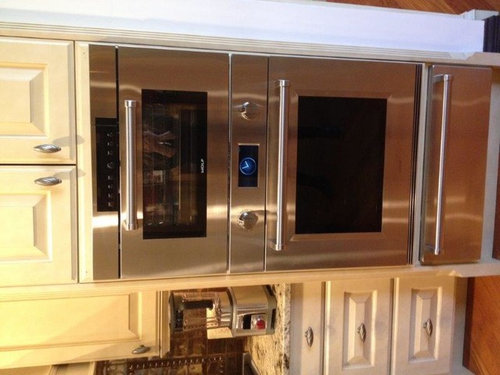
The width and height of the screenshot is (500, 375). I want to click on blender, so click(x=256, y=312).